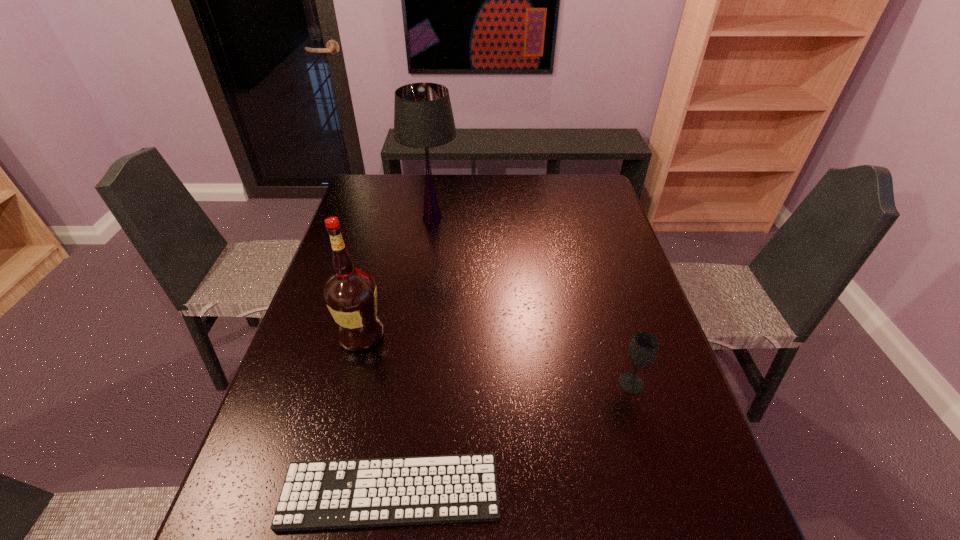
Where is `object that is the second closest to the second shortest object`? The width and height of the screenshot is (960, 540). object that is the second closest to the second shortest object is located at coordinates (350, 294).

Locate which object ranks second in proximity to the lampshade. Please provide its 2D coordinates. Your answer should be formatted as a tuple, i.e. [(x, y)], where the tuple contains the x and y coordinates of a point satisfying the conditions above.

[(643, 350)]

Image resolution: width=960 pixels, height=540 pixels. Find the location of `free spot that satisfies the following two spatial constraints: 1. on the front-facing side of the farthest object; 2. on the label of the second farthest object`. free spot that satisfies the following two spatial constraints: 1. on the front-facing side of the farthest object; 2. on the label of the second farthest object is located at coordinates pos(416,334).

The image size is (960, 540). What are the coordinates of `vacant space that satisfies the following two spatial constraints: 1. on the front-facing side of the second nearest object; 2. on the right side of the farthest object` in the screenshot? It's located at (409, 383).

Where is `vacant area in the image that satisfies the following two spatial constraints: 1. on the label of the nearest object; 2. on the left side of the alcohol`? Image resolution: width=960 pixels, height=540 pixels. vacant area in the image that satisfies the following two spatial constraints: 1. on the label of the nearest object; 2. on the left side of the alcohol is located at coordinates (321, 491).

Locate an element on the screen. This screenshot has width=960, height=540. vacant space that satisfies the following two spatial constraints: 1. on the label of the second nearest object; 2. on the left side of the third nearest object is located at coordinates (348, 383).

Where is `vacant region that satisfies the following two spatial constraints: 1. on the label of the third tallest object; 2. on the right side of the third shortest object`? The height and width of the screenshot is (540, 960). vacant region that satisfies the following two spatial constraints: 1. on the label of the third tallest object; 2. on the right side of the third shortest object is located at coordinates (348, 383).

Identify the location of vacant region that satisfies the following two spatial constraints: 1. on the front-facing side of the tallest object; 2. on the label of the third nearest object. This screenshot has width=960, height=540. (416, 334).

The height and width of the screenshot is (540, 960). In order to click on free location that satisfies the following two spatial constraints: 1. on the front-facing side of the second nearest object; 2. on the right side of the farthest object in this screenshot , I will do `click(409, 383)`.

Where is `blank area in the image that satisfies the following two spatial constraints: 1. on the front-facing side of the lampshade; 2. on the right side of the wineglass`? blank area in the image that satisfies the following two spatial constraints: 1. on the front-facing side of the lampshade; 2. on the right side of the wineglass is located at coordinates (409, 383).